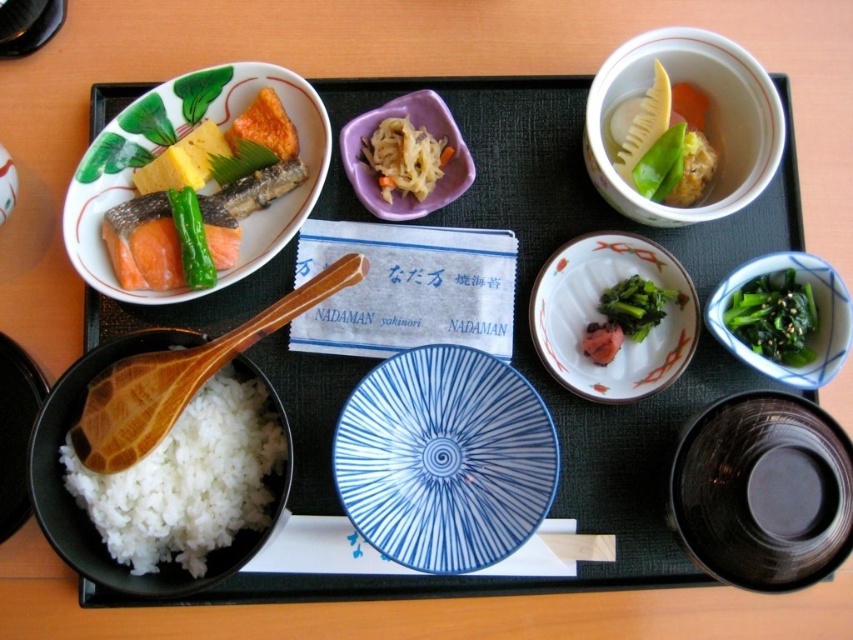
Consider the image. You are a food critic analyzing the arrangement of dishes on a black tray. You notice a specific point at coordinates [602,316]. Which dish is located at this point?

The point at coordinates [602,316] indicates the matte white bowl at center.

You are a chef arranging dishes on a tray. You have a matte white bowl at center and a green glossy cucumber at upper left. According to the scene, where should you place the green glossy cucumber relative to the matte white bowl?

The green glossy cucumber at upper left should be placed above the matte white bowl at center since the matte white bowl at center is positioned under it.